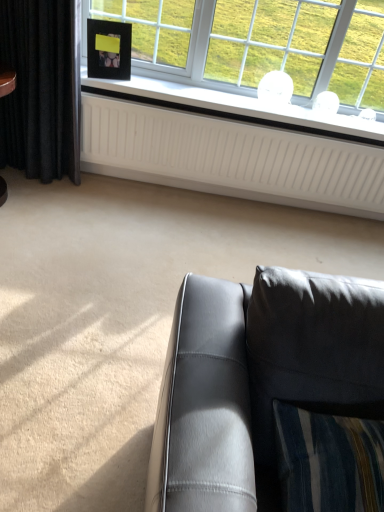
Question: Should I look upward or downward to see black matte picture frame at upper left?

Choices:
 (A) down
 (B) up

Answer: (B)

Question: Does black matte picture frame at upper left come behind white matte window sill at upper center?

Choices:
 (A) yes
 (B) no

Answer: (B)

Question: Is black matte picture frame at upper left looking in the opposite direction of white matte window sill at upper center?

Choices:
 (A) no
 (B) yes

Answer: (A)

Question: Can you confirm if black matte picture frame at upper left is positioned to the left of white matte window sill at upper center?

Choices:
 (A) yes
 (B) no

Answer: (A)

Question: Is black matte picture frame at upper left wider than white matte window sill at upper center?

Choices:
 (A) yes
 (B) no

Answer: (B)

Question: Is black matte picture frame at upper left far from white matte window sill at upper center?

Choices:
 (A) yes
 (B) no

Answer: (B)

Question: Can you confirm if black matte picture frame at upper left is shorter than white matte window sill at upper center?

Choices:
 (A) no
 (B) yes

Answer: (A)

Question: Is the position of black velvet curtain at left less distant than that of matte gray leather couch at lower right?

Choices:
 (A) yes
 (B) no

Answer: (B)

Question: From the image's perspective, is black velvet curtain at left below matte gray leather couch at lower right?

Choices:
 (A) yes
 (B) no

Answer: (B)

Question: Considering the relative positions of black velvet curtain at left and matte gray leather couch at lower right in the image provided, is black velvet curtain at left behind matte gray leather couch at lower right?

Choices:
 (A) yes
 (B) no

Answer: (A)

Question: Does black velvet curtain at left have a greater width compared to matte gray leather couch at lower right?

Choices:
 (A) yes
 (B) no

Answer: (B)

Question: Are black velvet curtain at left and matte gray leather couch at lower right beside each other?

Choices:
 (A) yes
 (B) no

Answer: (B)

Question: Does black velvet curtain at left have a larger size compared to matte gray leather couch at lower right?

Choices:
 (A) yes
 (B) no

Answer: (A)

Question: Is matte gray leather couch at lower right next to black matte picture frame at upper left?

Choices:
 (A) yes
 (B) no

Answer: (B)